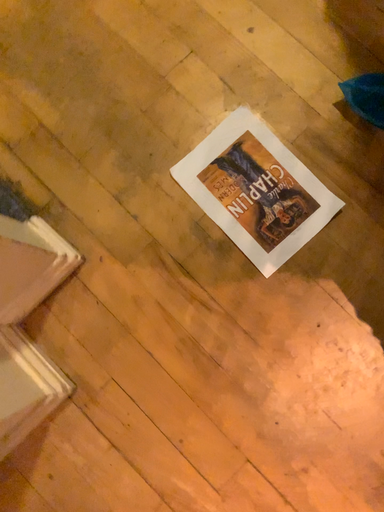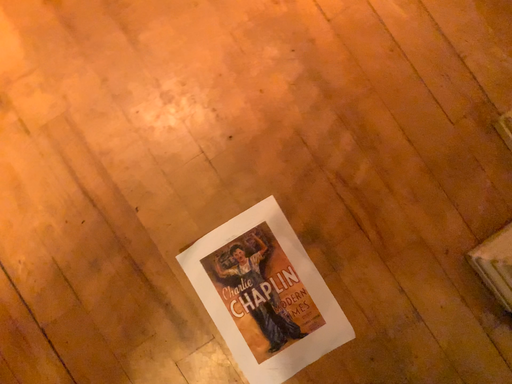
Question: How did the camera likely rotate when shooting the video?

Choices:
 (A) rotated downward
 (B) rotated upward

Answer: (B)